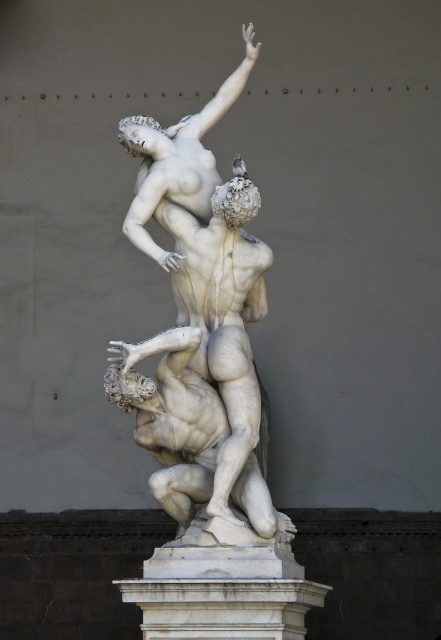
Question: Does white marble sculpture at center appear under white marble statue at center?

Choices:
 (A) yes
 (B) no

Answer: (B)

Question: Among these points, which one is nearest to the camera?

Choices:
 (A) (186, 451)
 (B) (230, 100)

Answer: (A)

Question: Can you confirm if white marble pedestal at center is bigger than white marble statue at upper center?

Choices:
 (A) yes
 (B) no

Answer: (B)

Question: Which of these objects is positioned closest to the white marble statue at center?

Choices:
 (A) white marble pedestal at center
 (B) white marble sculpture at center
 (C) white marble statue at upper center

Answer: (B)

Question: Which point is farther from the camera taking this photo?

Choices:
 (A) (185, 173)
 (B) (135, 580)
 (C) (190, 388)

Answer: (A)

Question: Observing the image, what is the correct spatial positioning of white marble sculpture at center in reference to white marble pedestal at center?

Choices:
 (A) above
 (B) below

Answer: (A)